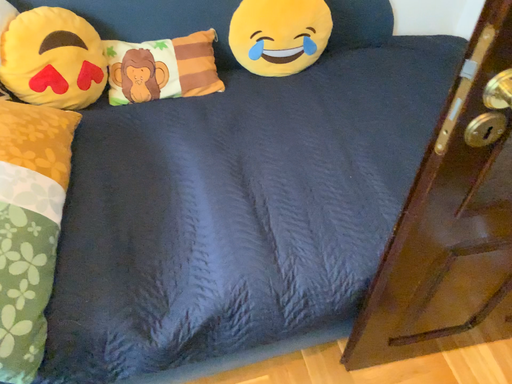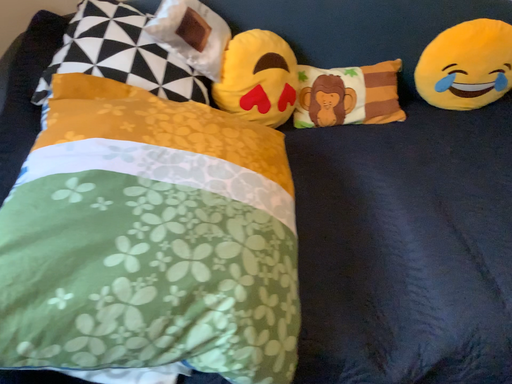
Question: Which way did the camera rotate in the video?

Choices:
 (A) rotated right
 (B) rotated left

Answer: (B)